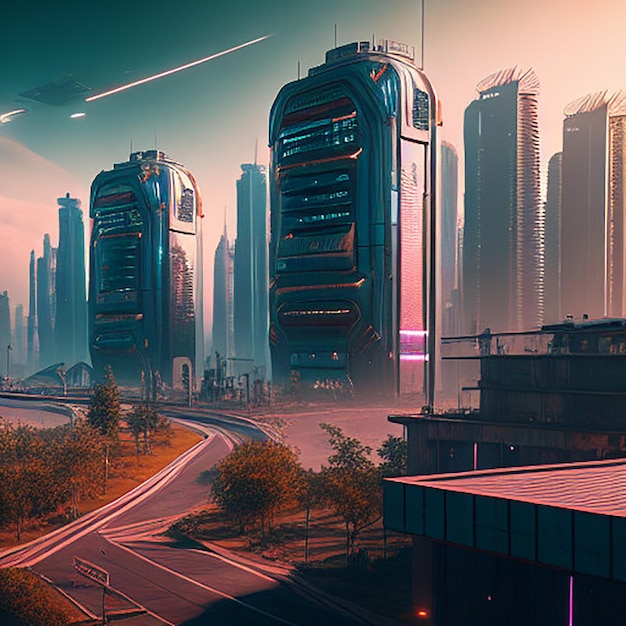
The height and width of the screenshot is (626, 626). Identify the location of orange light. (421, 612).